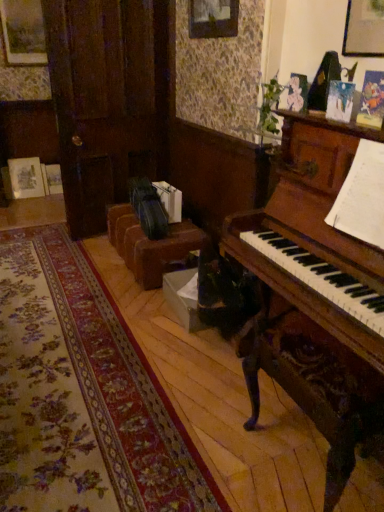
Question: Looking at their shapes, would you say brown leather couch at center is wider or thinner than wooden picture frame at upper right?

Choices:
 (A) wide
 (B) thin

Answer: (A)

Question: Visually, is brown leather couch at center positioned to the left or to the right of wooden picture frame at upper right?

Choices:
 (A) right
 (B) left

Answer: (B)

Question: Is brown leather couch at center inside or outside of wooden picture frame at upper right?

Choices:
 (A) inside
 (B) outside

Answer: (B)

Question: Relative to brown leather couch at center, is wooden picture frame at upper right in front or behind?

Choices:
 (A) front
 (B) behind

Answer: (A)

Question: Considering the relative positions of wooden picture frame at upper right and brown leather couch at center in the image provided, is wooden picture frame at upper right to the left or to the right of brown leather couch at center?

Choices:
 (A) right
 (B) left

Answer: (A)

Question: From the image's perspective, relative to brown leather couch at center, is wooden picture frame at upper right above or below?

Choices:
 (A) above
 (B) below

Answer: (A)

Question: Looking at the image, does wooden picture frame at upper right seem bigger or smaller compared to brown leather couch at center?

Choices:
 (A) small
 (B) big

Answer: (A)